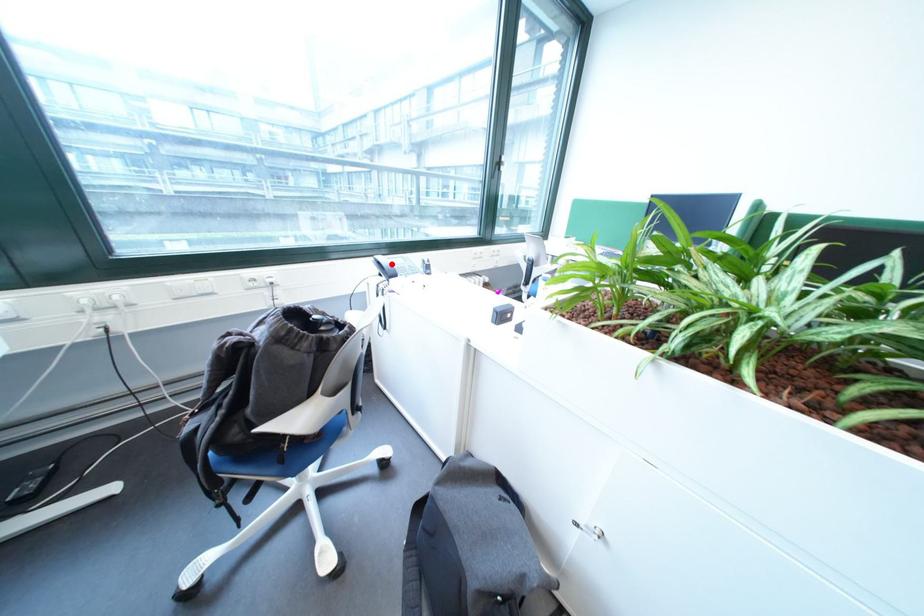
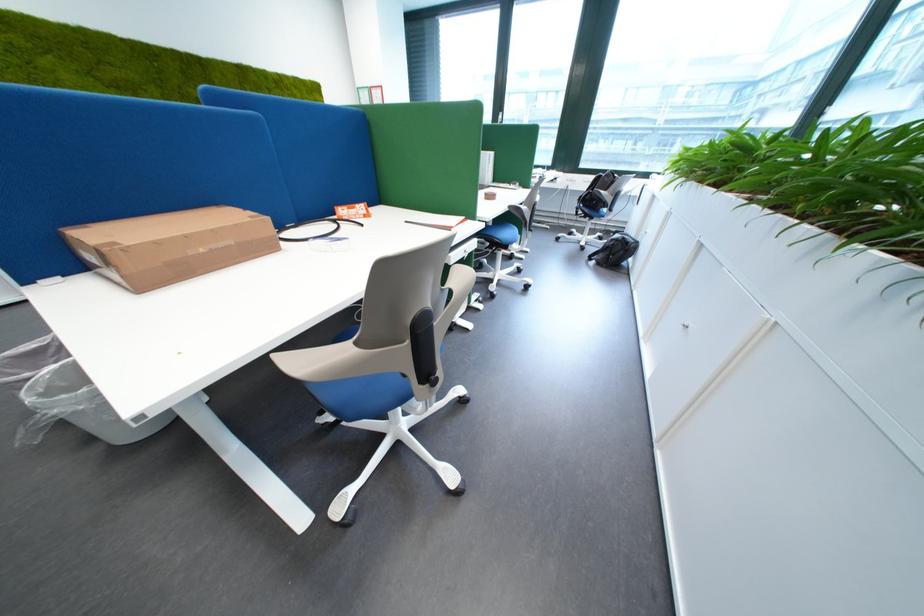
Question: I am providing you with two images of the same scene from different viewpoints. A red point is marked on the first image. Is the red point's position out of view in image 2?

Choices:
 (A) Yes
 (B) No

Answer: (A)